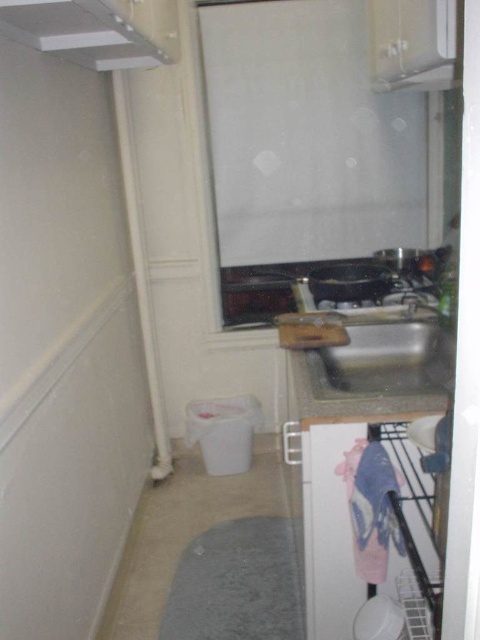
Question: Which of the following is the closest to the observer?

Choices:
 (A) (126, 60)
 (B) (348, 362)

Answer: (B)

Question: Among these objects, which one is farthest from the camera?

Choices:
 (A) metallic sink at center
 (B) white matte exhaust hood at upper left

Answer: (A)

Question: Is white matte exhaust hood at upper left thinner than metallic sink at center?

Choices:
 (A) yes
 (B) no

Answer: (A)

Question: Does white matte exhaust hood at upper left have a smaller size compared to metallic sink at center?

Choices:
 (A) yes
 (B) no

Answer: (B)

Question: Among these objects, which one is nearest to the camera?

Choices:
 (A) metallic sink at center
 (B) white matte exhaust hood at upper left

Answer: (B)

Question: From the image, what is the correct spatial relationship of white matte exhaust hood at upper left in relation to metallic sink at center?

Choices:
 (A) right
 (B) left

Answer: (B)